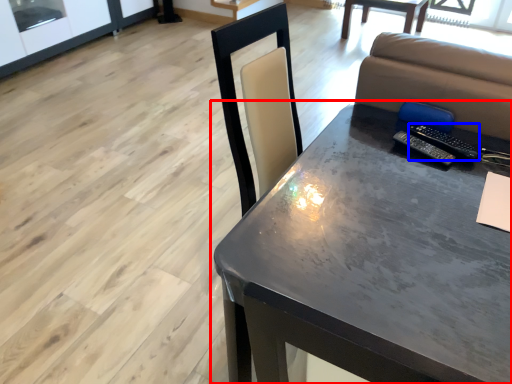
Question: Which object appears farthest to the camera in this image, table (highlighted by a red box) or remote (highlighted by a blue box)?

Choices:
 (A) table
 (B) remote

Answer: (B)